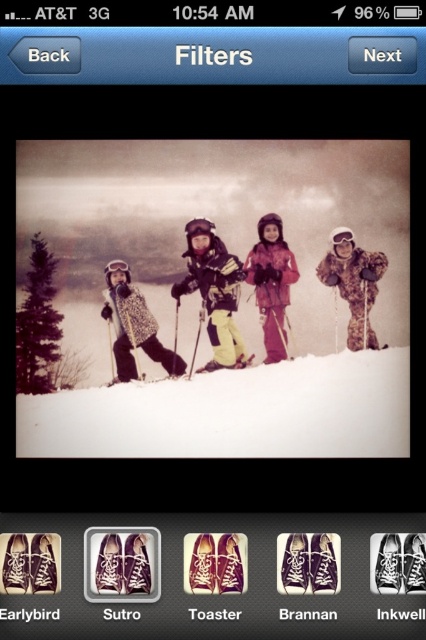
You are using a photo editing app and want to add a sticker between the two points, point (134, 288) and point (250, 356). Which point is closer to the viewer where you should place the sticker?

Point (134, 288) is further to the viewer than point (250, 356), so you should place the sticker closer to point (250, 356) since it is nearer to the viewer.

You are a photographer reviewing a photo on your phone. You notice two elements in the center of the image. One is the white powder snow at center and the other is the pink matte snowsuit at center. Which one appears closer to you in the photo?

The white powder snow at center is in front of the pink matte snowsuit at center, so it appears closer to you in the photo.